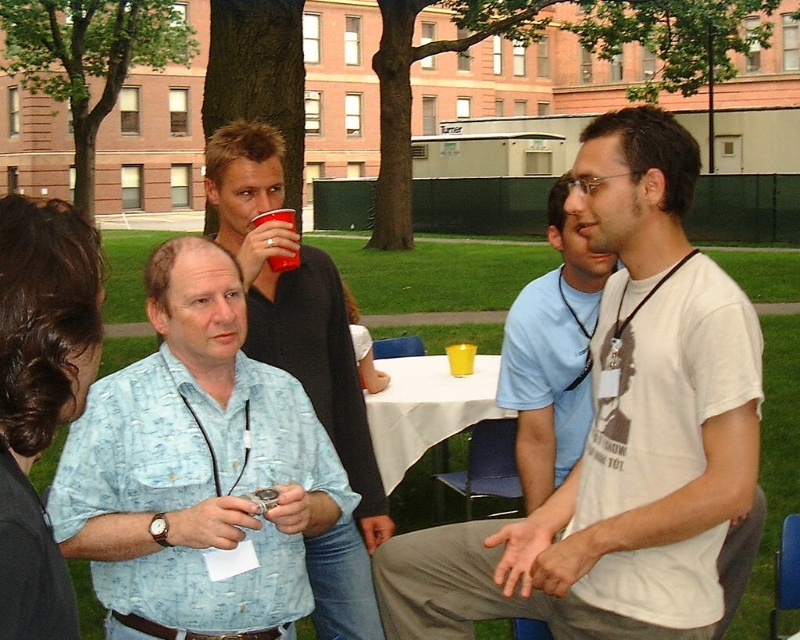
Where is the matte black shirt at center located in the image?

The matte black shirt at center is located at point 0.564 on the x axis and 0.380 on the y axis.